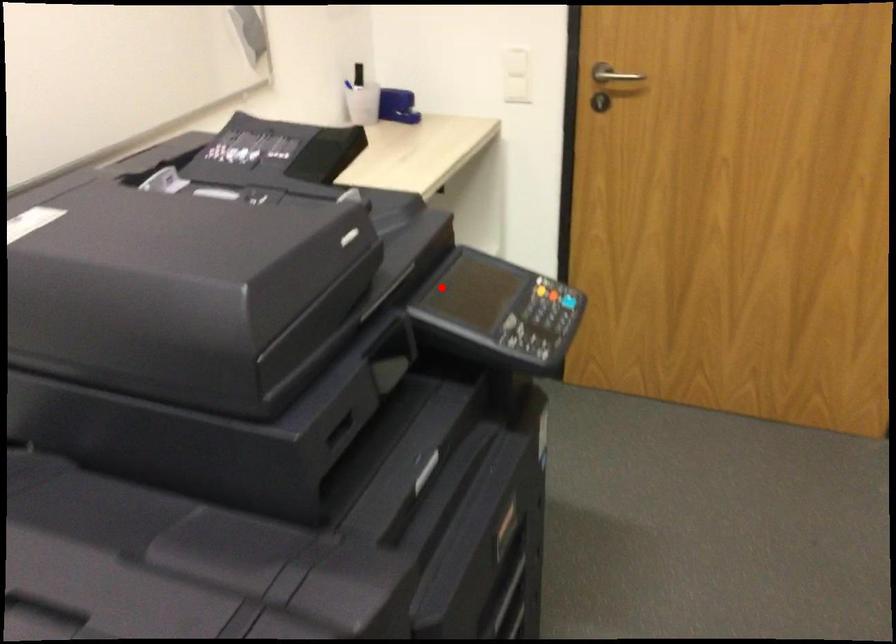
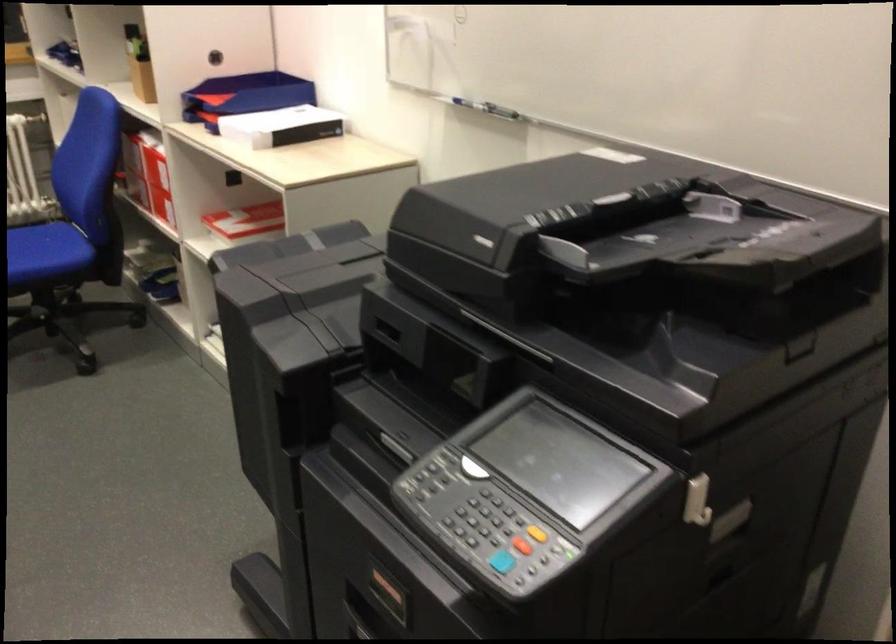
Question: A red point is marked in image1. In image2, is the corresponding 3D point closer to the camera or farther? Reply with the corresponding letter.

Choices:
 (A) The corresponding 3D point is closer.
 (B) The corresponding 3D point is farther.

Answer: (A)